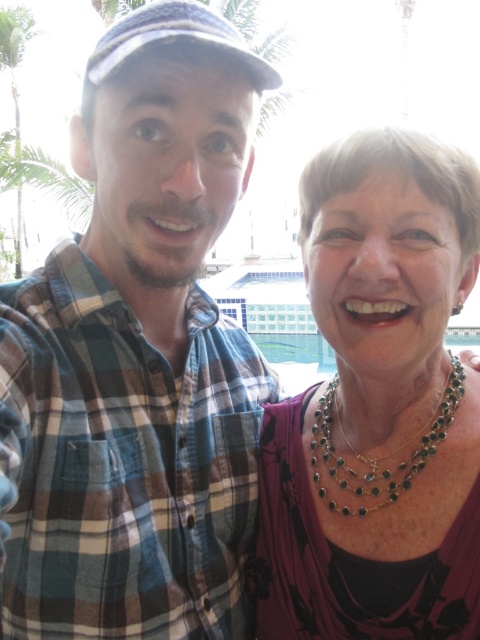
Question: Which point is farther to the camera?

Choices:
 (A) green beaded necklace at center
 (B) multicolored beaded necklace at right
 (C) plaid fabric shirt at left

Answer: (A)

Question: Which point is farther to the camera?

Choices:
 (A) multicolored beaded necklace at right
 (B) green beaded necklace at center

Answer: (B)

Question: Can you confirm if multicolored beaded necklace at right is positioned to the left of green beaded necklace at center?

Choices:
 (A) no
 (B) yes

Answer: (B)

Question: Among these points, which one is nearest to the camera?

Choices:
 (A) (320, 417)
 (B) (201, 346)

Answer: (B)

Question: Is multicolored beaded necklace at right positioned at the back of green beaded necklace at center?

Choices:
 (A) no
 (B) yes

Answer: (A)

Question: Does plaid fabric shirt at left appear on the left side of green beaded necklace at center?

Choices:
 (A) yes
 (B) no

Answer: (A)